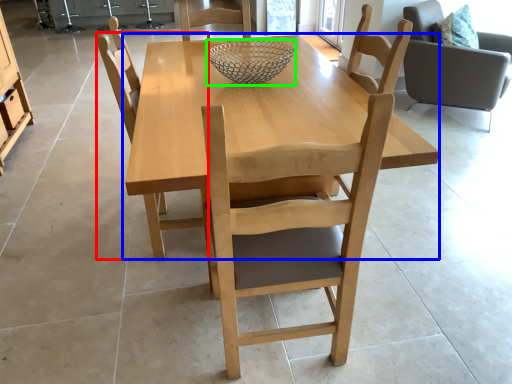
Question: Which object is positioned closest to chair (highlighted by a red box)? Select from kitchen & dining room table (highlighted by a blue box) and glass bowl (highlighted by a green box).

Choices:
 (A) kitchen & dining room table
 (B) glass bowl

Answer: (A)